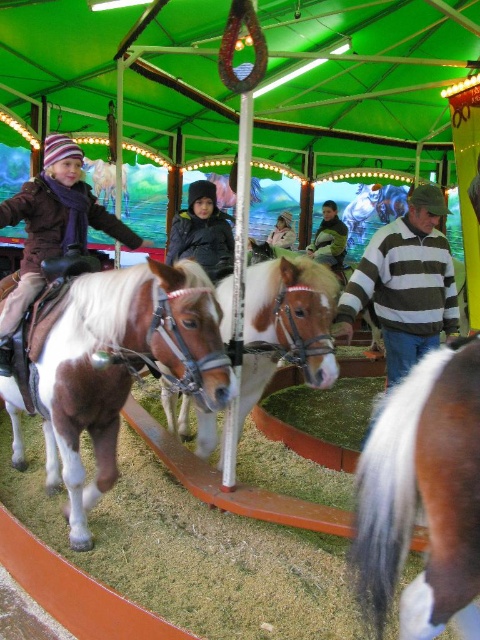
The image size is (480, 640). What do you see at coordinates (405, 284) in the screenshot? I see `striped sweater at center` at bounding box center [405, 284].

Image resolution: width=480 pixels, height=640 pixels. What do you see at coordinates (405, 284) in the screenshot?
I see `striped sweater at center` at bounding box center [405, 284].

Identify the location of striped sweater at center. The height and width of the screenshot is (640, 480). (405, 284).

Can you confirm if dark green sweater at center is positioned to the left of light brown leather jacket at center?

In fact, dark green sweater at center is to the right of light brown leather jacket at center.

Is dark green sweater at center smaller than light brown leather jacket at center?

No, dark green sweater at center is not smaller than light brown leather jacket at center.

This screenshot has width=480, height=640. What do you see at coordinates (328, 237) in the screenshot?
I see `dark green sweater at center` at bounding box center [328, 237].

The image size is (480, 640). In order to click on dark green sweater at center in this screenshot , I will do 328,237.

Who is positioned more to the right, brown glossy horse at center or dark green sweater at center?

dark green sweater at center is more to the right.

Who is more distant from viewer, (433, 506) or (323, 212)?

The point (323, 212) is more distant.

The height and width of the screenshot is (640, 480). Describe the element at coordinates (422, 496) in the screenshot. I see `brown glossy horse at center` at that location.

This screenshot has width=480, height=640. I want to click on brown glossy horse at center, so click(x=422, y=496).